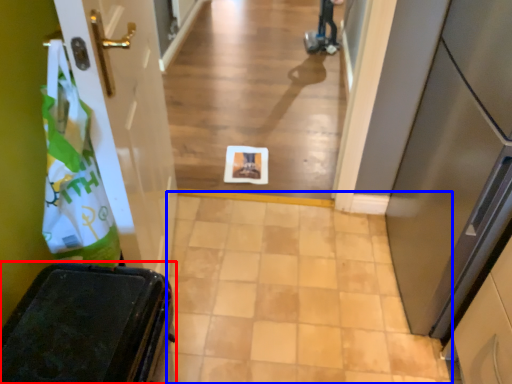
Question: Which object is further to the camera taking this photo, furniture (highlighted by a red box) or path (highlighted by a blue box)?

Choices:
 (A) furniture
 (B) path

Answer: (B)